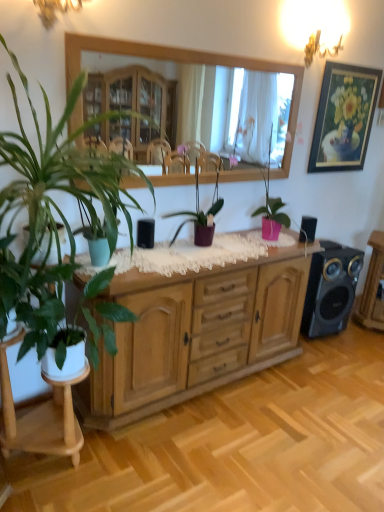
Question: From a real-world perspective, is metallic gold chandelier at upper right, the second lamp from the front, positioned under black matte speaker at center, the 3th speaker positioned from the right, based on gravity?

Choices:
 (A) no
 (B) yes

Answer: (A)

Question: Considering the relative sizes of metallic gold chandelier at upper right, which ranks as the 1th lamp in back-to-front order, and black matte speaker at center, marked as the 1th speaker in a front-to-back arrangement, in the image provided, is metallic gold chandelier at upper right, which ranks as the 1th lamp in back-to-front order, taller than black matte speaker at center, marked as the 1th speaker in a front-to-back arrangement,?

Choices:
 (A) yes
 (B) no

Answer: (A)

Question: Could you tell me if metallic gold chandelier at upper right, the second lamp from the front, is facing black matte speaker at center, marked as the 1th speaker in a front-to-back arrangement?

Choices:
 (A) no
 (B) yes

Answer: (A)

Question: Are metallic gold chandelier at upper right, the 1th lamp viewed from the right, and black matte speaker at center, the first speaker from the left, making contact?

Choices:
 (A) no
 (B) yes

Answer: (A)

Question: Is black matte speaker at center, the 3th speaker positioned from the right, at the back of metallic gold chandelier at upper right, which is counted as the 2th lamp, starting from the left?

Choices:
 (A) yes
 (B) no

Answer: (B)

Question: Relative to wooden mirror at upper center, is green matte plant at left, the first houseplant from the left, in front or behind?

Choices:
 (A) front
 (B) behind

Answer: (A)

Question: Looking at their shapes, would you say green matte plant at left, the first houseplant from the left, is wider or thinner than wooden mirror at upper center?

Choices:
 (A) wide
 (B) thin

Answer: (A)

Question: In terms of height, does green matte plant at left, the 4th houseplant viewed from the right, look taller or shorter compared to wooden mirror at upper center?

Choices:
 (A) short
 (B) tall

Answer: (A)

Question: Considering the relative positions of green matte plant at left, the 4th houseplant viewed from the right, and wooden mirror at upper center in the image provided, is green matte plant at left, the 4th houseplant viewed from the right, to the left or to the right of wooden mirror at upper center?

Choices:
 (A) left
 (B) right

Answer: (A)

Question: In terms of size, does wooden cabinet at center appear bigger or smaller than metallic gold chandelier at upper right, which ranks as the 1th lamp in back-to-front order?

Choices:
 (A) big
 (B) small

Answer: (A)

Question: Considering their positions, is wooden cabinet at center located in front of or behind metallic gold chandelier at upper right, the second lamp from the front?

Choices:
 (A) behind
 (B) front

Answer: (B)

Question: Considering the positions of wooden cabinet at center and metallic gold chandelier at upper right, which ranks as the 1th lamp in back-to-front order, in the image, is wooden cabinet at center taller or shorter than metallic gold chandelier at upper right, which ranks as the 1th lamp in back-to-front order,?

Choices:
 (A) short
 (B) tall

Answer: (B)

Question: From a real-world perspective, is wooden cabinet at center above or below metallic gold chandelier at upper right, which is the 2th lamp in bottom-to-top order?

Choices:
 (A) below
 (B) above

Answer: (A)

Question: Would you say green matte plant at left, the first houseplant from the left, is inside or outside gold-framed painting at upper right?

Choices:
 (A) outside
 (B) inside

Answer: (A)

Question: From the image's perspective, is green matte plant at left, the 4th houseplant viewed from the right, located above or below gold-framed painting at upper right?

Choices:
 (A) below
 (B) above

Answer: (A)